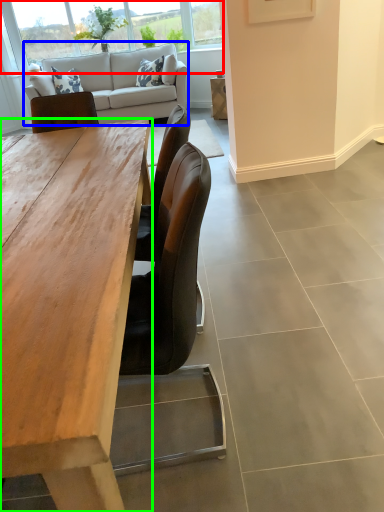
Question: Considering the real-world distances, which object is farthest from window (highlighted by a red box)? studio couch (highlighted by a blue box) or desk (highlighted by a green box)?

Choices:
 (A) studio couch
 (B) desk

Answer: (B)